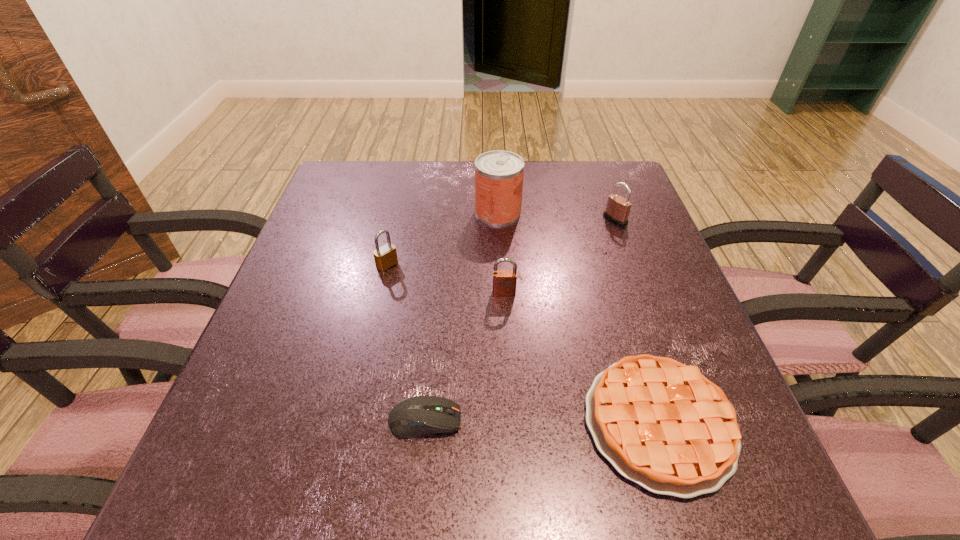
Identify the location of vacant space at the near edge of the desktop. (511, 475).

This screenshot has height=540, width=960. I want to click on free space at the left edge of the desktop, so click(x=265, y=438).

This screenshot has height=540, width=960. In the image, there is a desktop. What are the coordinates of `free space at the right edge` in the screenshot? It's located at (636, 340).

I want to click on free region at the far left corner, so click(x=330, y=176).

Identify the location of vacant region at the near left corner of the desktop. (267, 464).

Find the location of a particular element. The width and height of the screenshot is (960, 540). vacant space at the far right corner of the desktop is located at coordinates (611, 183).

In the image, there is a desktop. Identify the location of vacant area at the near right corner. coord(768,515).

This screenshot has width=960, height=540. I want to click on vacant area that lies between the pie and the computer equipment, so click(541, 421).

Locate an element on the screen. The height and width of the screenshot is (540, 960). vacant space that is in between the farthest padlock and the nearest padlock is located at coordinates (560, 256).

Locate an element on the screen. This screenshot has width=960, height=540. free space that is in between the leftmost padlock and the computer equipment is located at coordinates pos(406,342).